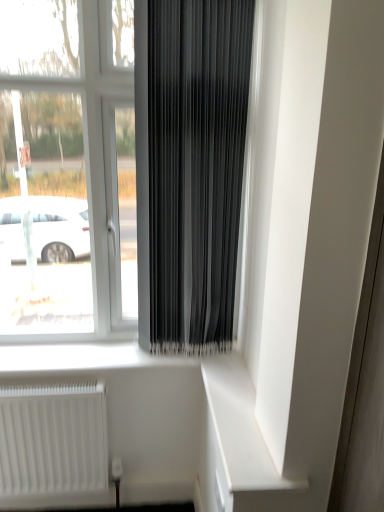
Find the location of a particular element. vacant space in white matte radiator at lower left (from a real-world perspective) is located at coordinates pyautogui.click(x=71, y=507).